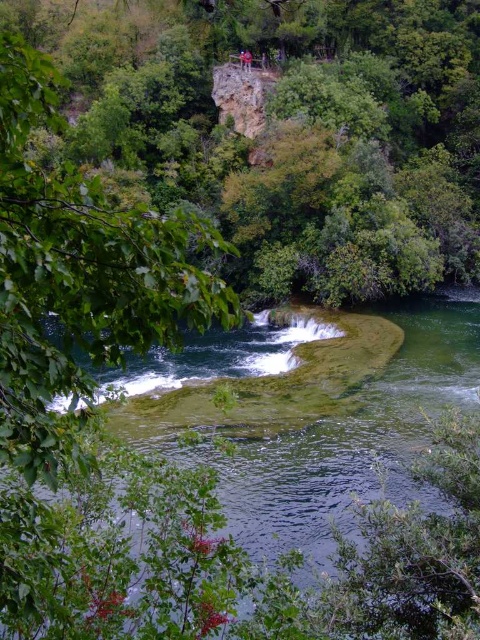
You are standing at the edge of the river and notice the clear water at center and the blue fabric person at upper center. Which object is wider when viewed from your current position?

The clear water at center is wider than the blue fabric person at upper center.

You are standing in the natural landscape scene. You see the clear water at center and the blue fabric person at upper center. Which object is positioned more to the right side of the scene?

The clear water at center is positioned more to the right side of the scene compared to the blue fabric person at upper center.